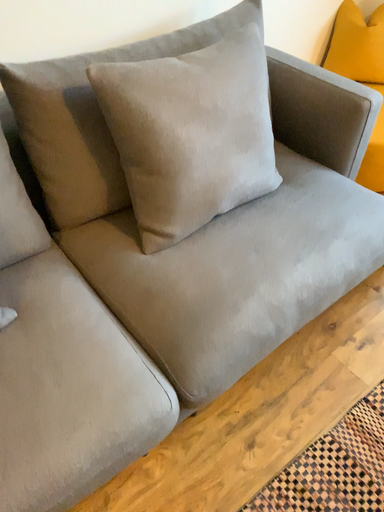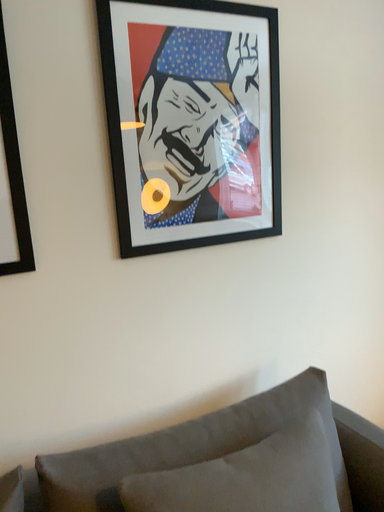
Question: Which way did the camera rotate in the video?

Choices:
 (A) rotated downward
 (B) rotated upward

Answer: (B)